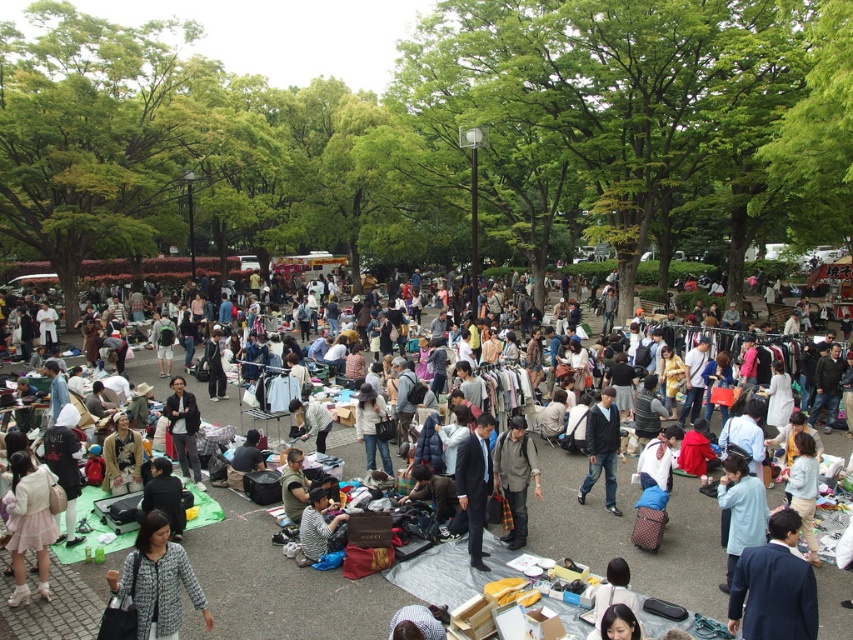
Question: Is light blue denim jacket at center positioned behind patterned fabric jacket at lower left?

Choices:
 (A) yes
 (B) no

Answer: (A)

Question: Which is nearer to the dark gray suit at center?

Choices:
 (A) dark blue jeans at center
 (B) light blue denim jacket at center
 (C) dark blue suit at lower right

Answer: (B)

Question: Is light pink fabric skirt at lower left bigger than dark gray suit at center?

Choices:
 (A) yes
 (B) no

Answer: (B)

Question: Is light pink fabric skirt at lower left wider than dark gray suit at center?

Choices:
 (A) no
 (B) yes

Answer: (B)

Question: Considering the real-world distances, which object is farthest from the dark gray suit at center?

Choices:
 (A) light pink fabric skirt at lower left
 (B) dark gray fabric jacket at center
 (C) striped fabric shirt at lower center

Answer: (B)

Question: Which of these objects is positioned closest to the dark blue suit at center?

Choices:
 (A) light pink fabric skirt at lower left
 (B) patterned fabric jacket at lower left
 (C) light blue denim jacket at center

Answer: (C)